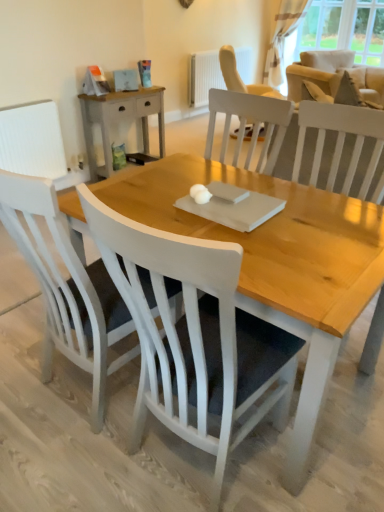
What do you see at coordinates (204, 76) in the screenshot? The image size is (384, 512). I see `white textured radiator at upper center` at bounding box center [204, 76].

Locate an element on the screen. white wood chair at upper right, the 3th chair when ordered from left to right is located at coordinates (340, 140).

Find the location of a particular element. white wood chair at center, which is the second chair from left to right is located at coordinates (194, 335).

Describe the element at coordinates (345, 29) in the screenshot. Image resolution: width=384 pixels, height=512 pixels. I see `transparent curtain at upper right` at that location.

Measure the distance between white textured curtain at upper right and camera.

white textured curtain at upper right and camera are 5.36 meters apart from each other.

Identify the location of beige fabric armchair at upper right. This screenshot has width=384, height=512. (333, 74).

Locate an element on the screen. white textured radiator at upper center is located at coordinates (204, 76).

How different are the orientations of white wood chair at center, which is the second chair from left to right, and beige fabric armchair at upper right in degrees?

The angular difference between white wood chair at center, which is the second chair from left to right, and beige fabric armchair at upper right is 118 degrees.

Considering the sizes of objects white wood chair at center, which is the second chair from left to right, and beige fabric armchair at upper right in the image provided, who is bigger, white wood chair at center, which is the second chair from left to right, or beige fabric armchair at upper right?

beige fabric armchair at upper right is bigger.

Considering the relative sizes of white wood chair at center, which ranks as the first chair in front-to-back order, and beige fabric armchair at upper right in the image provided, is white wood chair at center, which ranks as the first chair in front-to-back order, shorter than beige fabric armchair at upper right?

Incorrect, the height of white wood chair at center, which ranks as the first chair in front-to-back order, does not fall short of that of beige fabric armchair at upper right.

Looking at this image, from the image's perspective, would you say white wood chair at center, which is the second chair from left to right, is shown under beige fabric armchair at upper right?

Correct, white wood chair at center, which is the second chair from left to right, appears lower than beige fabric armchair at upper right in the image.

Is beige fabric armchair at upper right wider or thinner than transparent curtain at upper right?

beige fabric armchair at upper right is wider than transparent curtain at upper right.

This screenshot has width=384, height=512. I want to click on armchair that appears on the left of transparent curtain at upper right, so click(333, 74).

Does beige fabric armchair at upper right have a smaller size compared to transparent curtain at upper right?

Actually, beige fabric armchair at upper right might be larger than transparent curtain at upper right.

Consider the image. Is beige fabric armchair at upper right far from transparent curtain at upper right?

beige fabric armchair at upper right is near transparent curtain at upper right, not far away.

Is beige fabric armchair at upper right at the back of white wood chair at upper right, which is the third chair in front-to-back order?

No, white wood chair at upper right, which is the third chair in front-to-back order, is not facing the opposite direction of beige fabric armchair at upper right.

Can you see white wood chair at upper right, which is the third chair in front-to-back order, touching beige fabric armchair at upper right?

No, white wood chair at upper right, which is the third chair in front-to-back order, is not making contact with beige fabric armchair at upper right.

Find the location of `the 1st chair in front when counting from the beige fabric armchair at upper right`. the 1st chair in front when counting from the beige fabric armchair at upper right is located at coordinates (340, 140).

Considering the relative sizes of white wood chair at upper right, which is the first chair in back-to-front order, and beige fabric armchair at upper right in the image provided, is white wood chair at upper right, which is the first chair in back-to-front order, shorter than beige fabric armchair at upper right?

No.

Locate an element on the screen. The width and height of the screenshot is (384, 512). nightstand above the white matte chair at lower left, which ranks as the 2th chair in front-to-back order (from the image's perspective) is located at coordinates (120, 119).

Can you tell me how much white matte chair at lower left, arranged as the 1th chair when viewed from the left, and light wood/rough surface nightstand at upper left differ in facing direction?

91.2 degrees separate the facing orientations of white matte chair at lower left, arranged as the 1th chair when viewed from the left, and light wood/rough surface nightstand at upper left.

Can you confirm if white matte chair at lower left, arranged as the 3th chair when viewed from the right, is smaller than light wood/rough surface nightstand at upper left?

Incorrect, white matte chair at lower left, arranged as the 3th chair when viewed from the right, is not smaller in size than light wood/rough surface nightstand at upper left.

From the picture: Would you say white wood chair at center, the third chair positioned from the back, is inside or outside white matte chair at lower left, arranged as the 1th chair when viewed from the left?

white wood chair at center, the third chair positioned from the back, is located beyond the bounds of white matte chair at lower left, arranged as the 1th chair when viewed from the left.

How many degrees apart are the facing directions of white wood chair at center, the third chair positioned from the back, and white matte chair at lower left, which ranks as the 2th chair in front-to-back order?

0.00182 degrees.

Is white wood chair at center, which is the second chair from left to right, positioned with its back to white matte chair at lower left, arranged as the 3th chair when viewed from the right?

That's not correct — white wood chair at center, which is the second chair from left to right, is not looking away from white matte chair at lower left, arranged as the 3th chair when viewed from the right.

Is white wood chair at center, the third chair positioned from the back, in contact with white textured radiator at upper center?

white wood chair at center, the third chair positioned from the back, and white textured radiator at upper center are not in contact.

Is white wood chair at center, which is the second chair from left to right, to the right of white textured radiator at upper center from the viewer's perspective?

Incorrect, white wood chair at center, which is the second chair from left to right, is not on the right side of white textured radiator at upper center.

From a real-world perspective, is white wood chair at center, which ranks as the first chair in front-to-back order, above or below white textured radiator at upper center?

From a real-world perspective, white wood chair at center, which ranks as the first chair in front-to-back order, is physically above white textured radiator at upper center.

From the image's perspective, is white textured radiator at upper center located beneath white wood chair at upper right, which appears as the first chair when viewed from the right?

No, from the image's perspective, white textured radiator at upper center is not beneath white wood chair at upper right, which appears as the first chair when viewed from the right.

Is there a large distance between white textured radiator at upper center and white wood chair at upper right, the 3th chair when ordered from left to right?

Absolutely, white textured radiator at upper center is distant from white wood chair at upper right, the 3th chair when ordered from left to right.

Between white textured radiator at upper center and white wood chair at upper right, the 3th chair when ordered from left to right, which one appears on the left side from the viewer's perspective?

white textured radiator at upper center.

You are a GUI agent. You are given a task and a screenshot of the screen. Output one action in this format:
    pyautogui.click(x=<x>, y=<y>)
    Task: Click on the armchair to the right of white wood chair at center, the second chair positioned from the right
    
    Given the screenshot: What is the action you would take?
    pyautogui.click(x=333, y=74)

At what (x,y) coordinates should I click in order to perform the action: click on armchair located in front of the transparent curtain at upper right. Please return your answer as a coordinate pair (x, y). The image size is (384, 512). Looking at the image, I should click on (333, 74).

From the image, which object appears to be nearer to white wood chair at center, the second chair positioned from the right, white textured curtain at upper right or white wood chair at upper right, which is the third chair in front-to-back order?

The object closer to white wood chair at center, the second chair positioned from the right, is white wood chair at upper right, which is the third chair in front-to-back order.

Estimate the real-world distances between objects in this image. Which object is closer to beige fabric armchair at upper right, white textured radiator at upper center or transparent curtain at upper right?

transparent curtain at upper right is positioned closer to the anchor beige fabric armchair at upper right.

Considering their positions, is beige fabric armchair at upper right positioned further to white wood chair at center, which ranks as the first chair in front-to-back order, than white textured radiator at upper center?

Among the two, beige fabric armchair at upper right is located further to white wood chair at center, which ranks as the first chair in front-to-back order.

In the scene shown: Based on their spatial positions, is white matte chair at lower left, arranged as the 1th chair when viewed from the left, or white textured radiator at upper center further from white textured curtain at upper right?

white matte chair at lower left, arranged as the 1th chair when viewed from the left, is further to white textured curtain at upper right.

When comparing their distances from light wood/rough surface nightstand at upper left, does transparent curtain at upper right or white wood chair at center, which ranks as the first chair in front-to-back order, seem closer?

Among the two, white wood chair at center, which ranks as the first chair in front-to-back order, is located nearer to light wood/rough surface nightstand at upper left.

From the image, which object appears to be farther from white matte chair at lower left, arranged as the 3th chair when viewed from the right, beige fabric armchair at upper right or transparent curtain at upper right?

transparent curtain at upper right is positioned further to the anchor white matte chair at lower left, arranged as the 3th chair when viewed from the right.

Based on their spatial positions, is transparent curtain at upper right or light wood/rough surface nightstand at upper left further from beige fabric armchair at upper right?

light wood/rough surface nightstand at upper left lies further to beige fabric armchair at upper right than the other object.

Estimate the real-world distances between objects in this image. Which object is further from white textured curtain at upper right, white wood chair at center, which ranks as the first chair in front-to-back order, or white matte chair at lower left, arranged as the 3th chair when viewed from the right?

white wood chair at center, which ranks as the first chair in front-to-back order.

I want to click on armchair between white wood chair at center, which ranks as the first chair in front-to-back order, and white textured radiator at upper center, along the z-axis, so click(333, 74).

Find the location of a particular element. This screenshot has height=512, width=384. nightstand between white wood chair at center, which is the second chair from left to right, and transparent curtain at upper right from front to back is located at coordinates (120, 119).

Where is `armchair between white wood chair at upper right, the 3th chair when ordered from left to right, and transparent curtain at upper right in the front-back direction`? The image size is (384, 512). armchair between white wood chair at upper right, the 3th chair when ordered from left to right, and transparent curtain at upper right in the front-back direction is located at coordinates (x=333, y=74).

This screenshot has height=512, width=384. What are the coordinates of `nightstand positioned between white matte chair at lower left, which is counted as the 2th chair, starting from the back, and transparent curtain at upper right from near to far` in the screenshot? It's located at (120, 119).